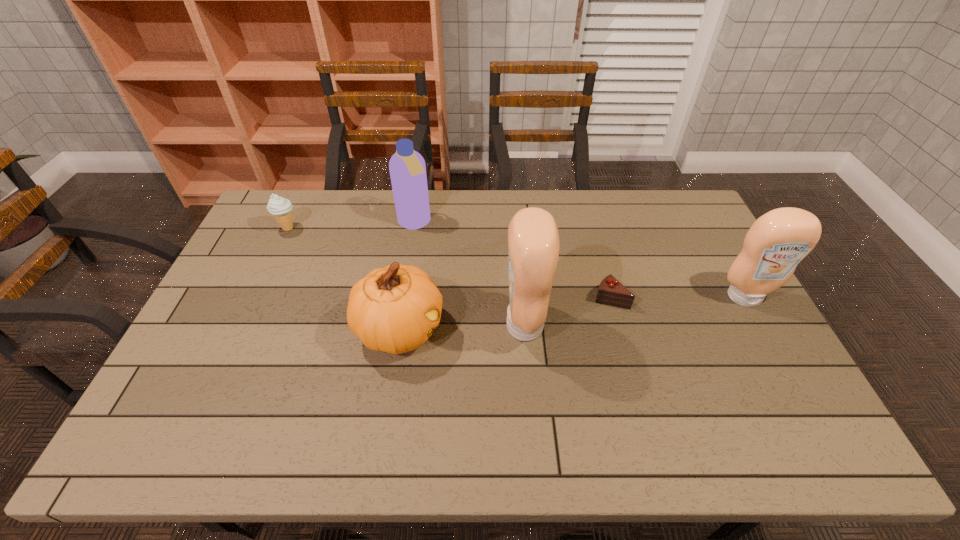
Locate an element on the screen. object present at the left edge is located at coordinates (280, 207).

Where is `object that is at the right edge`? Image resolution: width=960 pixels, height=540 pixels. object that is at the right edge is located at coordinates (779, 240).

Identify the location of object that is at the far left corner. The width and height of the screenshot is (960, 540). (280, 207).

What are the coordinates of `vacant space at the far edge` in the screenshot? It's located at pos(380,221).

Image resolution: width=960 pixels, height=540 pixels. Find the location of `free space at the left edge of the desktop`. free space at the left edge of the desktop is located at coordinates (267, 251).

Identify the location of vacant space at the right edge. The image size is (960, 540). (727, 347).

The width and height of the screenshot is (960, 540). In the image, there is a desktop. What are the coordinates of `vacant region at the near left corner` in the screenshot? It's located at (221, 381).

In the image, there is a desktop. At what (x,y) coordinates should I click in order to perform the action: click on vacant space at the far right corner. Please return your answer as a coordinate pair (x, y). Looking at the image, I should click on (656, 214).

Find the location of a particular element. The width and height of the screenshot is (960, 540). vacant region at the near right corner of the desktop is located at coordinates (742, 400).

This screenshot has width=960, height=540. Identify the location of empty space that is in between the fourth object from left to right and the shorter condiment. (635, 311).